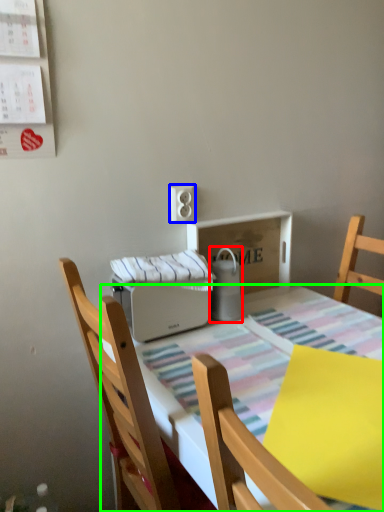
Question: Considering the real-world distances, which object is closest to appliance (highlighted by a red box)? electric outlet (highlighted by a blue box) or kitchen & dining room table (highlighted by a green box).

Choices:
 (A) electric outlet
 (B) kitchen & dining room table

Answer: (A)